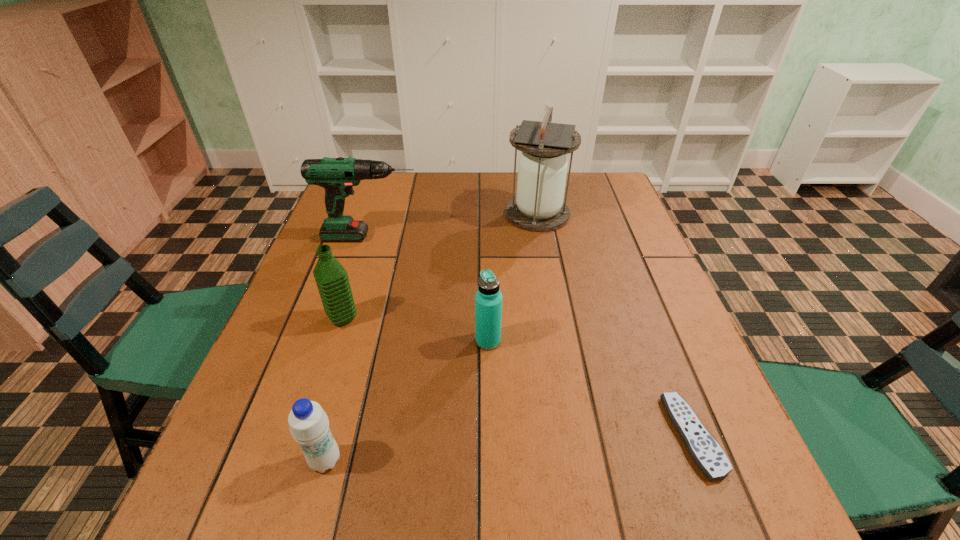
Locate an element on the screen. the tallest object is located at coordinates [538, 206].

Identify the location of the fifth object from left to right. (538, 206).

Image resolution: width=960 pixels, height=540 pixels. Find the location of `drill`. drill is located at coordinates (337, 176).

Locate an element on the screen. This screenshot has width=960, height=540. the farthest water bottle is located at coordinates (331, 278).

The image size is (960, 540). What are the coordinates of `the rightmost water bottle` in the screenshot? It's located at (488, 299).

This screenshot has height=540, width=960. Identify the location of the fourth object from left to right. (488, 299).

I want to click on the nearest water bottle, so click(309, 425).

Where is `the rightmost object`? the rightmost object is located at coordinates (707, 454).

Find the location of a particular element. remote control is located at coordinates (707, 454).

This screenshot has width=960, height=540. I want to click on free region located on the back of the tallest object, so click(532, 182).